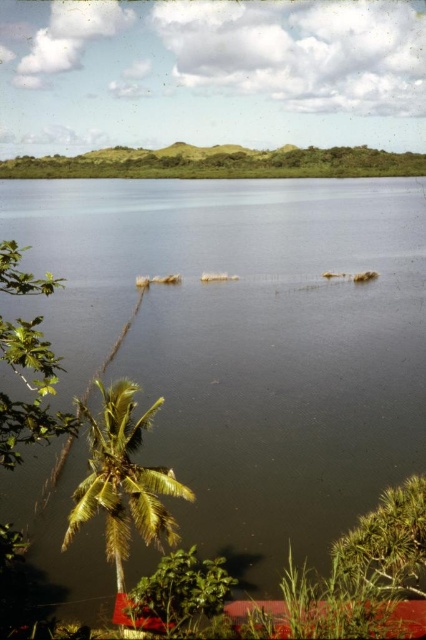
Who is positioned more to the right, greenish-brown water at center or green leafy palm tree at lower left?

Positioned to the right is greenish-brown water at center.

Is greenish-brown water at center smaller than green leafy palm tree at lower left?

Incorrect, greenish-brown water at center is not smaller in size than green leafy palm tree at lower left.

Is point (247, 500) positioned after point (158, 486)?

Yes, point (247, 500) is farther from viewer.

Find the location of a particular element. greenish-brown water at center is located at coordinates (245, 340).

Between greenish-brown water at center and green leafy tree at lower left, which one is positioned higher?

greenish-brown water at center is higher up.

Which of these two, greenish-brown water at center or green leafy tree at lower left, stands shorter?

With less height is green leafy tree at lower left.

Is point (425, 273) less distant than point (37, 340)?

No, (425, 273) is further to viewer.

I want to click on greenish-brown water at center, so click(x=245, y=340).

Does green leafy palm tree at lower left have a lesser height compared to green leafy tree at lower left?

Indeed, green leafy palm tree at lower left has a lesser height compared to green leafy tree at lower left.

Which of these two, green leafy palm tree at lower left or green leafy tree at lower left, stands taller?

Standing taller between the two is green leafy tree at lower left.

Between point (155, 477) and point (40, 385), which one is positioned in front?

Point (40, 385) is more forward.

You are a GUI agent. You are given a task and a screenshot of the screen. Output one action in this format:
    pyautogui.click(x=<x>, y=<y>)
    Task: Click on the green leafy palm tree at lower left
    
    Given the screenshot: What is the action you would take?
    pyautogui.click(x=123, y=480)